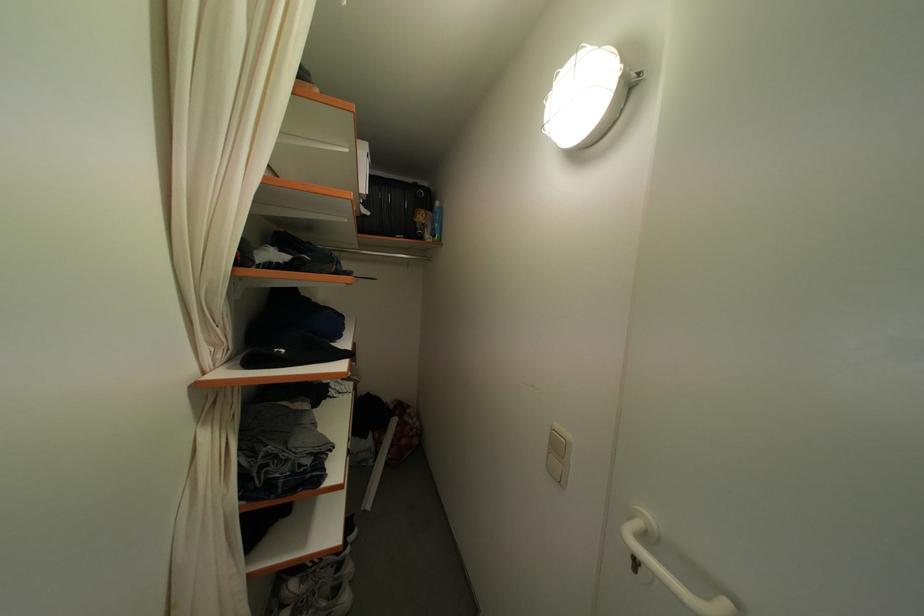
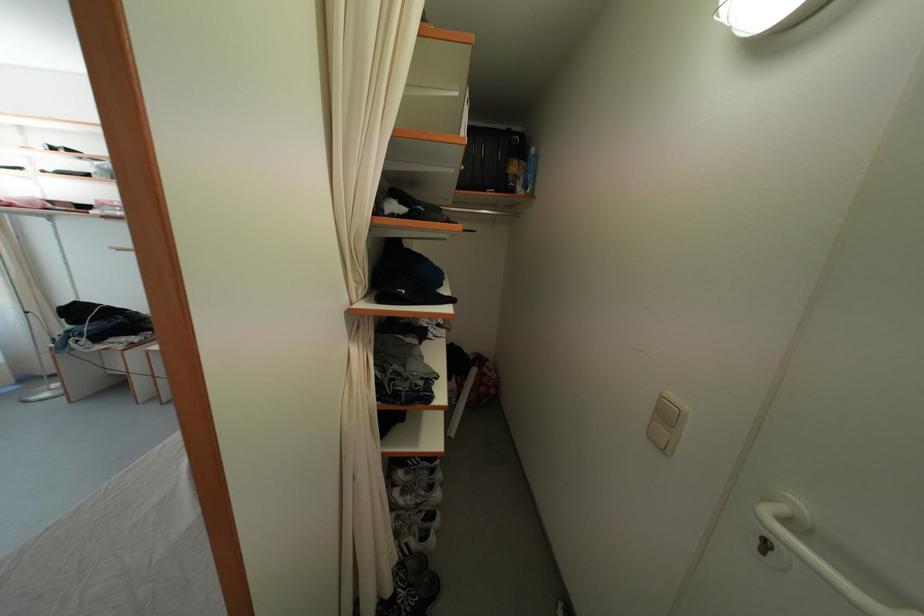
Question: The camera is either moving clockwise (left) or counter-clockwise (right) around the object. The first image is from the beginning of the video and the second image is from the end. Is the camera moving left or right when shooting the video?

Choices:
 (A) Left
 (B) Right

Answer: (B)